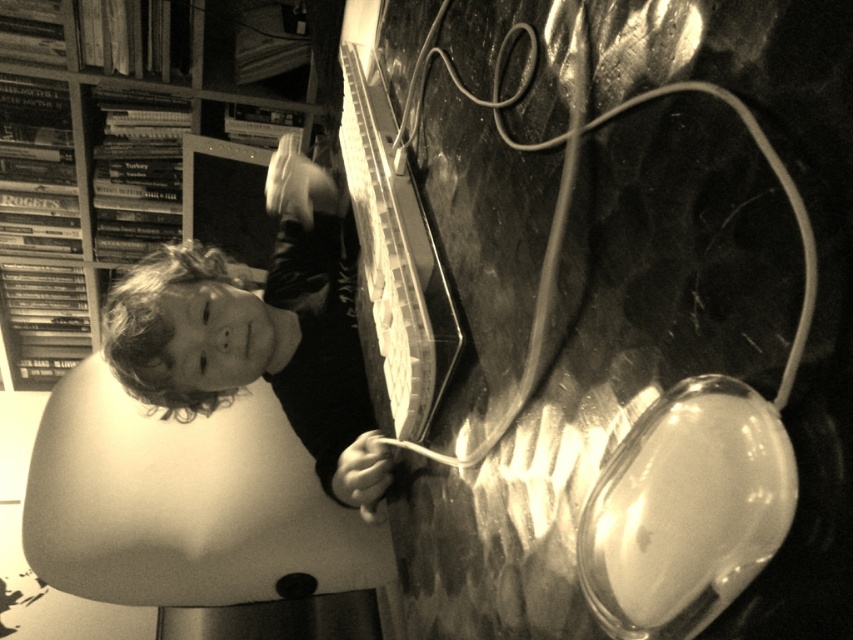
Is point (268, 276) positioned before point (35, 116)?

Yes, point (268, 276) is in front of point (35, 116).

Does point (363, 378) come farther from viewer compared to point (70, 12)?

That is False.

Find the location of `smooth skin child at upper left`. smooth skin child at upper left is located at coordinates (260, 333).